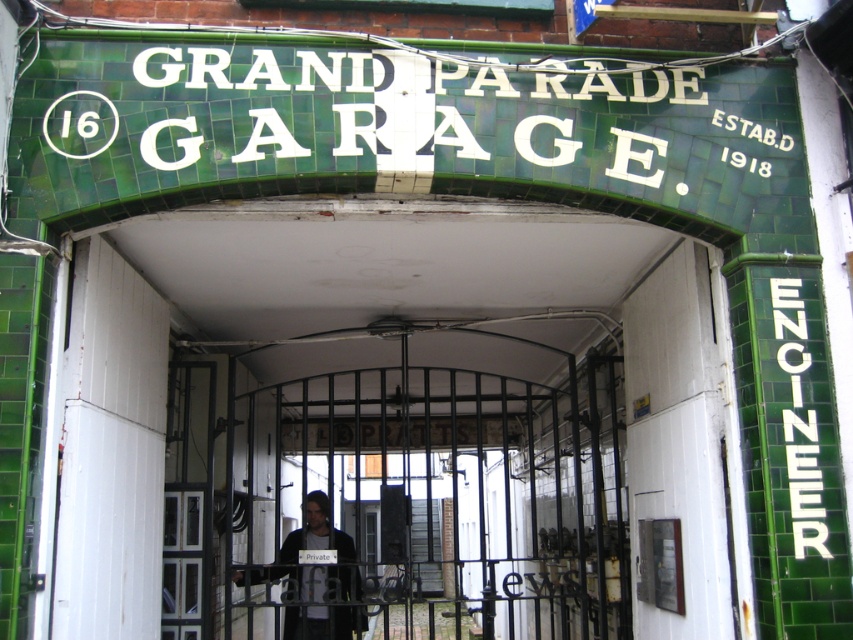
You are standing at the entrance of Grand Parade Garage and want to locate two specific points marked on the image. The first point is at coordinates point (822, 484) and the second is at point (357, 573). Which of these two points is closer to you as you face the entrance?

Point (822, 484) is in front of point (357, 573), so it is closer to you as you face the entrance.